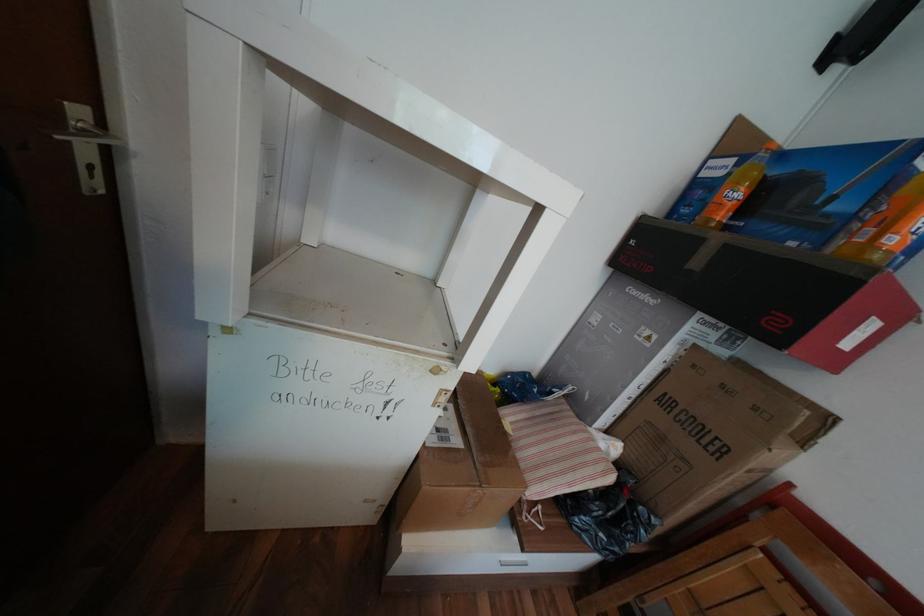
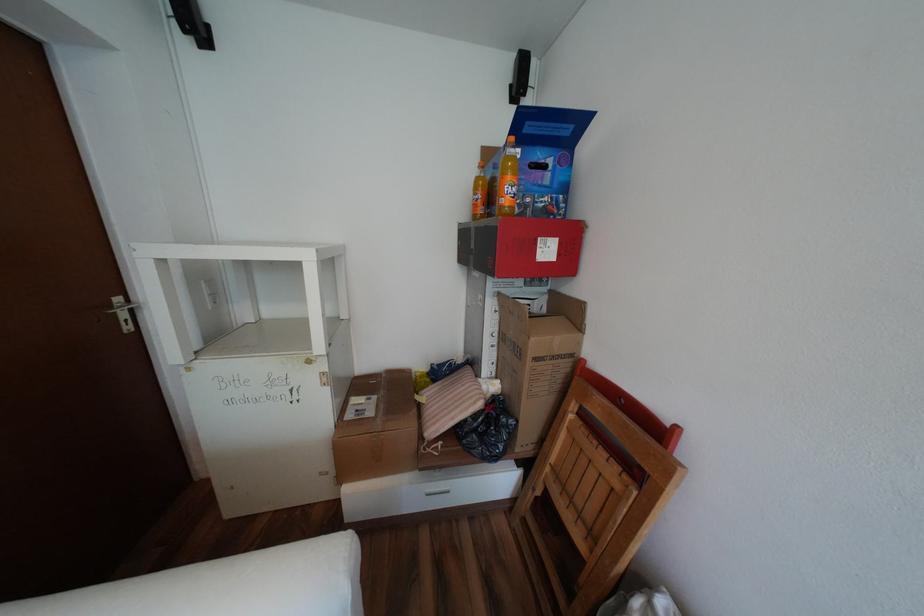
In the second image, find the point that corresponds to [651,387] in the first image.

(505, 334)